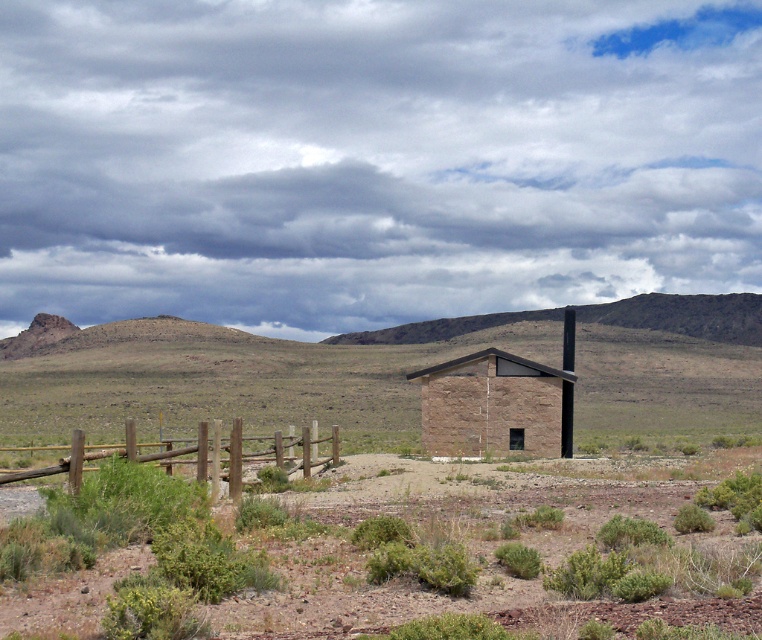
Is green shrubbery at center positioned in front of brown stone hut at center?

That is True.

What do you see at coordinates (373, 554) in the screenshot? I see `green shrubbery at center` at bounding box center [373, 554].

What do you see at coordinates (373, 554) in the screenshot? This screenshot has height=640, width=762. I see `green shrubbery at center` at bounding box center [373, 554].

Locate an element on the screen. The image size is (762, 640). green shrubbery at center is located at coordinates tap(373, 554).

Between point (532, 403) and point (130, 440), which one is positioned in front?

Positioned in front is point (130, 440).

The height and width of the screenshot is (640, 762). Identify the location of brown stone hut at center. (491, 404).

Locate an element on the screen. brown stone hut at center is located at coordinates (491, 404).

The image size is (762, 640). Describe the element at coordinates (373, 554) in the screenshot. I see `green shrubbery at center` at that location.

Who is taller, green shrubbery at center or brown wooden fence at lower left?

brown wooden fence at lower left

Who is more distant from viewer, (650, 612) or (170, 464)?

The point (170, 464) is more distant.

Locate an element on the screen. green shrubbery at center is located at coordinates (373, 554).